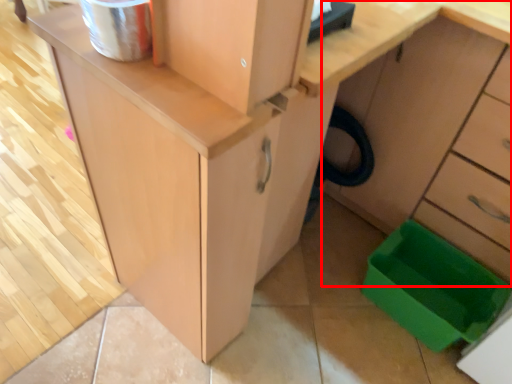
Question: From the image, what is the correct spatial relationship of cabinetry (annotated by the red box) in relation to storage box?

Choices:
 (A) left
 (B) right

Answer: (B)